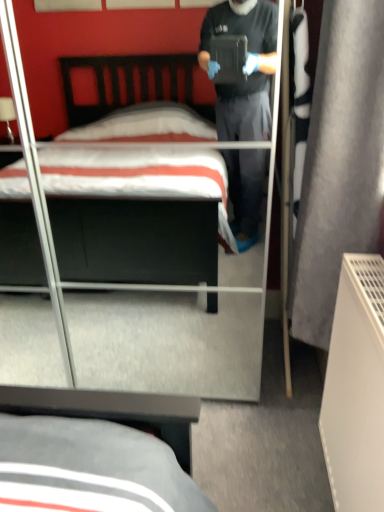
In order to face gray fabric curtain at right, should I rotate leftwards or rightwards?

To face it directly, rotate right by 17.946 degrees.

The width and height of the screenshot is (384, 512). What do you see at coordinates (339, 163) in the screenshot?
I see `gray fabric curtain at right` at bounding box center [339, 163].

What is the approximate width of gray fabric curtain at right?

7.75 inches.

Where is `gray fabric curtain at right`? This screenshot has height=512, width=384. gray fabric curtain at right is located at coordinates (339, 163).

What do you see at coordinates (137, 214) in the screenshot?
I see `matte black bed at center` at bounding box center [137, 214].

Locate an element on the screen. The height and width of the screenshot is (512, 384). matte black bed at center is located at coordinates (137, 214).

Locate an element on the screen. This screenshot has width=384, height=512. gray fabric curtain at right is located at coordinates (339, 163).

Between matte black bed at center and gray fabric curtain at right, which one appears on the left side from the viewer's perspective?

Positioned to the left is matte black bed at center.

From the picture: In the image, is matte black bed at center positioned in front of or behind gray fabric curtain at right?

Clearly, matte black bed at center is behind gray fabric curtain at right.

Is point (139, 232) closer to camera compared to point (357, 35)?

No, (139, 232) is behind (357, 35).

Looking at this image, from the image's perspective, is matte black bed at center above gray fabric curtain at right?

Yes, from the image's perspective, matte black bed at center is over gray fabric curtain at right.

From a real-world perspective, which object stands above the other?

gray fabric curtain at right, from a real-world perspective.

Considering the sizes of matte black bed at center and gray fabric curtain at right in the image, is matte black bed at center wider or thinner than gray fabric curtain at right?

Considering their sizes, matte black bed at center looks broader than gray fabric curtain at right.

Does matte black bed at center have a greater height compared to gray fabric curtain at right?

Yes, matte black bed at center is taller than gray fabric curtain at right.

Can you confirm if matte black bed at center is bigger than gray fabric curtain at right?

Yes.

Is matte black bed at center not inside gray fabric curtain at right?

matte black bed at center lies outside gray fabric curtain at right's area.

In the scene shown: Is matte black bed at center far from gray fabric curtain at right?

Yes, matte black bed at center is far from gray fabric curtain at right.

Is gray fabric curtain at right at the back of matte black bed at center?

matte black bed at center is not turned away from gray fabric curtain at right.

Locate an element on the screen. The height and width of the screenshot is (512, 384). curtain below the matte black bed at center (from the image's perspective) is located at coordinates (339, 163).

Does gray fabric curtain at right appear on the right side of matte black bed at center?

Indeed, gray fabric curtain at right is positioned on the right side of matte black bed at center.

Which object is further away from the camera taking this photo, gray fabric curtain at right or matte black bed at center?

Positioned behind is matte black bed at center.

Does point (378, 42) come behind point (181, 65)?

No, (378, 42) is closer to viewer.

From the image's perspective, between gray fabric curtain at right and matte black bed at center, who is located below?

gray fabric curtain at right, from the image's perspective.

From a real-world perspective, between gray fabric curtain at right and matte black bed at center, who is vertically higher?

From a 3D spatial view, gray fabric curtain at right is above.

Which object is wider, gray fabric curtain at right or matte black bed at center?

Wider between the two is matte black bed at center.

Is gray fabric curtain at right shorter than matte black bed at center?

Correct, gray fabric curtain at right is not as tall as matte black bed at center.

In the scene shown: Considering the sizes of objects gray fabric curtain at right and matte black bed at center in the image provided, who is smaller, gray fabric curtain at right or matte black bed at center?

gray fabric curtain at right is smaller.

Based on the photo, is gray fabric curtain at right not inside matte black bed at center?

Indeed, gray fabric curtain at right is completely outside matte black bed at center.

Is gray fabric curtain at right not near matte black bed at center?

Yes, gray fabric curtain at right and matte black bed at center are located far from each other.

Is gray fabric curtain at right turned away from matte black bed at center?

That's not correct — gray fabric curtain at right is not looking away from matte black bed at center.

Measure the distance between gray fabric curtain at right and matte black bed at center.

gray fabric curtain at right and matte black bed at center are 1.12 meters apart.

This screenshot has width=384, height=512. What are the coordinates of `bed below the gray fabric curtain at right (from a real-world perspective)` in the screenshot? It's located at (137, 214).

The height and width of the screenshot is (512, 384). Find the location of `bed behind the gray fabric curtain at right`. bed behind the gray fabric curtain at right is located at coordinates (137, 214).

This screenshot has width=384, height=512. In the image, there is a gray fabric curtain at right. In order to click on bed above it (from the image's perspective) in this screenshot , I will do `click(137, 214)`.